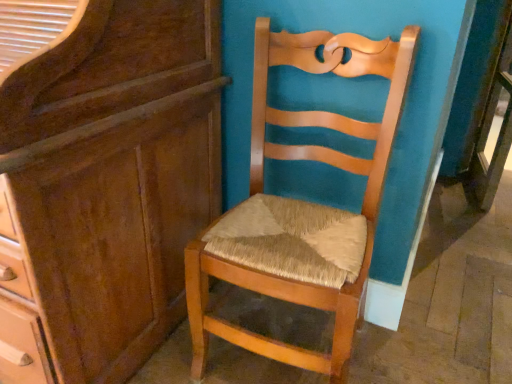
Question: Can you confirm if matte brown cabinet at left is shorter than natural wood chair at center?

Choices:
 (A) yes
 (B) no

Answer: (B)

Question: Is matte brown cabinet at left oriented away from natural wood chair at center?

Choices:
 (A) yes
 (B) no

Answer: (B)

Question: Can you confirm if matte brown cabinet at left is bigger than natural wood chair at center?

Choices:
 (A) no
 (B) yes

Answer: (B)

Question: Is matte brown cabinet at left positioned in front of natural wood chair at center?

Choices:
 (A) no
 (B) yes

Answer: (B)

Question: Could you tell me if matte brown cabinet at left is turned towards natural wood chair at center?

Choices:
 (A) yes
 (B) no

Answer: (B)

Question: Can natural wood chair at center be found inside matte brown cabinet at left?

Choices:
 (A) yes
 (B) no

Answer: (B)

Question: Is natural wood chair at center to the right of matte brown cabinet at left from the viewer's perspective?

Choices:
 (A) yes
 (B) no

Answer: (A)

Question: Does natural wood chair at center come behind matte brown cabinet at left?

Choices:
 (A) no
 (B) yes

Answer: (B)

Question: Is natural wood chair at center facing towards matte brown cabinet at left?

Choices:
 (A) yes
 (B) no

Answer: (B)

Question: Can you confirm if natural wood chair at center is shorter than matte brown cabinet at left?

Choices:
 (A) yes
 (B) no

Answer: (A)

Question: From a real-world perspective, does natural wood chair at center stand above matte brown cabinet at left?

Choices:
 (A) no
 (B) yes

Answer: (A)

Question: Is natural wood chair at center bigger than matte brown cabinet at left?

Choices:
 (A) yes
 (B) no

Answer: (B)

Question: From the image's perspective, is matte brown cabinet at left located above or below natural wood chair at center?

Choices:
 (A) above
 (B) below

Answer: (A)